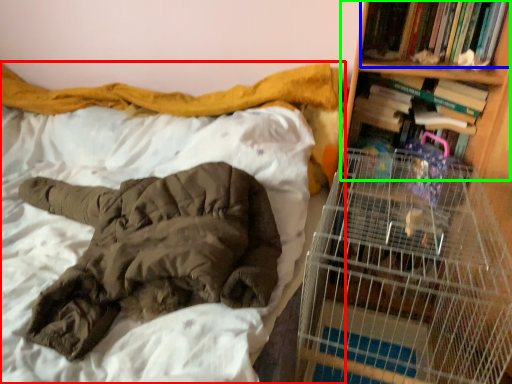
Question: Which is nearer to the bed (highlighted by a red box)? book (highlighted by a blue box) or bookshelf (highlighted by a green box).

Choices:
 (A) book
 (B) bookshelf

Answer: (A)